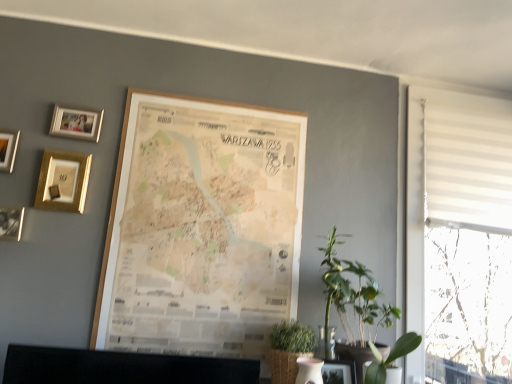
Question: In the image, is matte gold picture frame at upper left, the 4th picture frame when ordered from left to right, positioned in front of or behind green leafy plant at right, placed as the 2th plant when sorted from right to left?

Choices:
 (A) behind
 (B) front

Answer: (A)

Question: From a real-world perspective, relative to green leafy plant at right, the first plant viewed from the left, is matte gold picture frame at upper left, the 4th picture frame when ordered from left to right, vertically above or below?

Choices:
 (A) below
 (B) above

Answer: (B)

Question: Which of these objects is positioned closest to the wooden photo frame at upper left, which appears as the sixth picture frame when viewed from the right?

Choices:
 (A) green leafy plant at lower right, positioned as the 1th plant in right-to-left order
 (B) green leafy plant at lower center, the second houseplant when ordered from right to left
 (C) matte gold picture frame at upper left, the third picture frame in the right-to-left sequence
 (D) white textured blinds at right
 (E) gold metallic photo frame at upper left, arranged as the 4th picture frame when viewed from the right

Answer: (E)

Question: Based on their relative distances, which object is farther from the green leafy plant at lower right, the first houseplant positioned from the right?

Choices:
 (A) wooden photo frame at upper left, marked as the first picture frame in a left-to-right arrangement
 (B) green leafy plant at lower right, which ranks as the second plant in left-to-right order
 (C) gold metallic photo frame at upper left, acting as the 3th picture frame starting from the left
 (D) matte gold picture frame at upper left, the 4th picture frame when ordered from left to right
 (E) wooden map at center, placed as the second picture frame when sorted from right to left

Answer: (A)